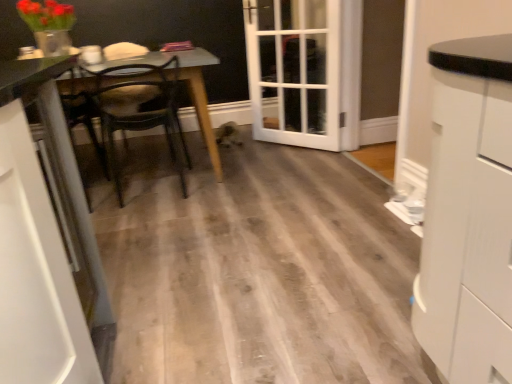
At what (x,y) coordinates should I click in order to perform the action: click on vacant area to the right of wooden table at left. Please return your answer as a coordinate pair (x, y). The image size is (512, 384). Looking at the image, I should click on (276, 171).